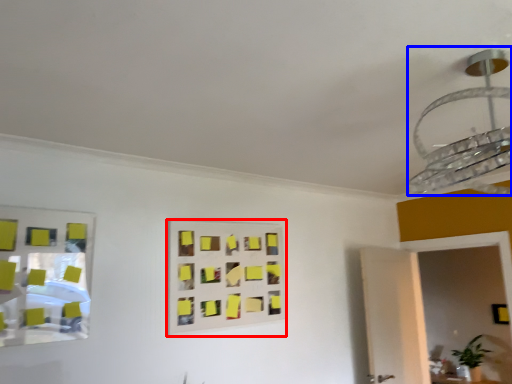
Question: Which of the following is the farthest to the observer, rectangle (highlighted by a red box) or lamp (highlighted by a blue box)?

Choices:
 (A) rectangle
 (B) lamp

Answer: (A)